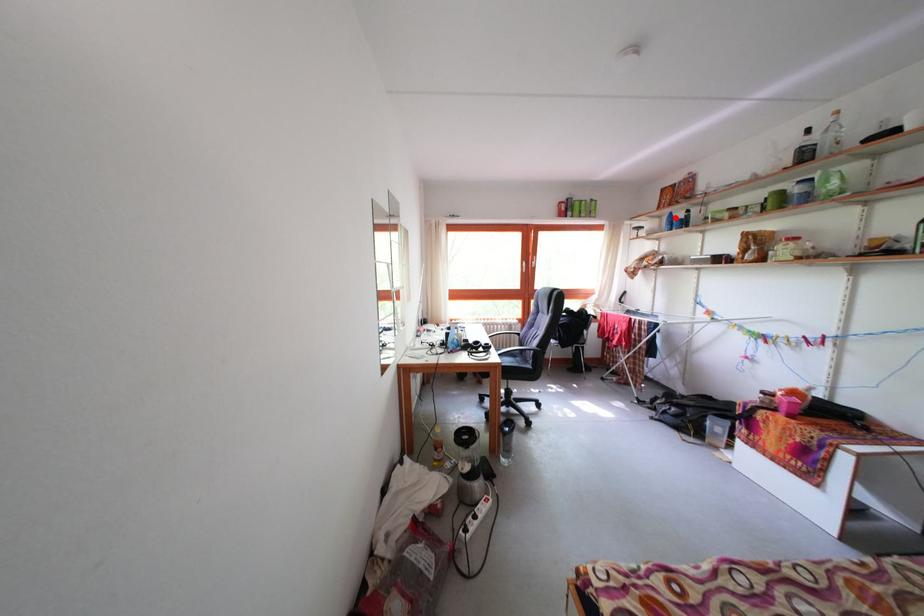
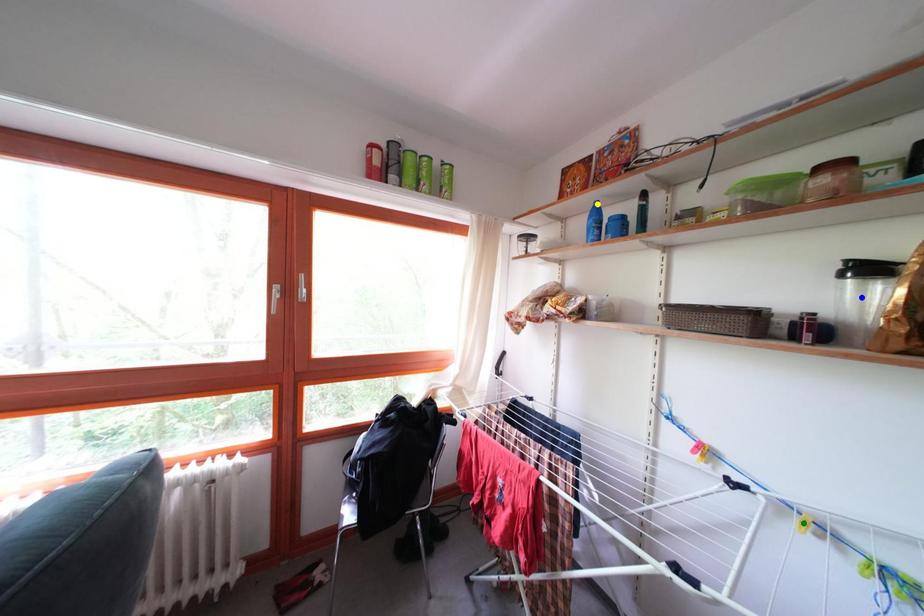
Question: I am providing you with two images of the same scene from different viewpoints. A red point is marked on the first image. You are given multiple points on the second image. Which mark in image 2 goes with the point in image 1?

Choices:
 (A) green point
 (B) yellow point
 (C) blue point

Answer: (B)